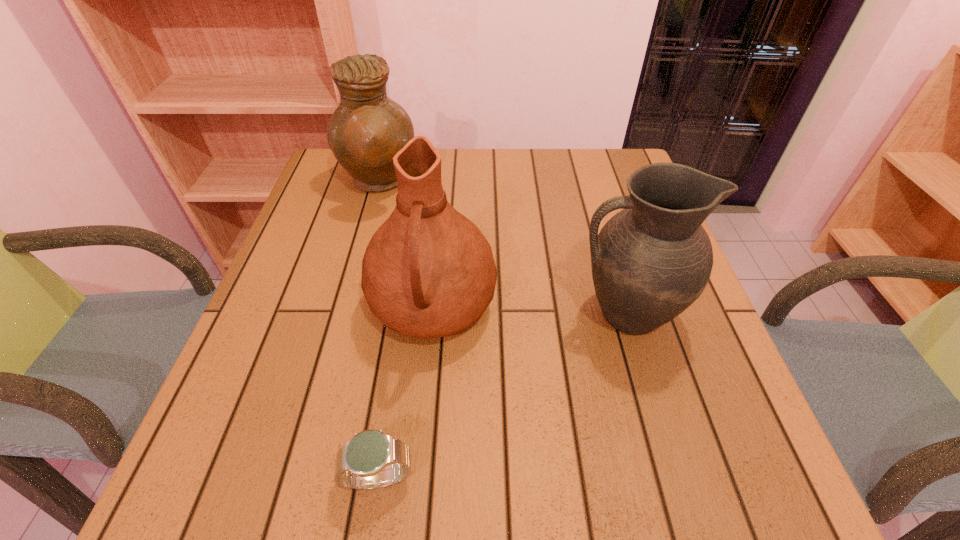
Image resolution: width=960 pixels, height=540 pixels. In order to click on empty location between the rightmost pitcher and the farthest pitcher in this screenshot , I will do `click(502, 248)`.

Locate an element on the screen. free space between the farthest pitcher and the watch is located at coordinates (378, 330).

This screenshot has height=540, width=960. I want to click on blank region between the farthest pitcher and the rightmost pitcher, so click(502, 248).

Where is `empty location between the rightmost pitcher and the watch`? This screenshot has width=960, height=540. empty location between the rightmost pitcher and the watch is located at coordinates (502, 396).

At what (x,y) coordinates should I click in order to perform the action: click on empty space between the farthest pitcher and the shortest object. Please return your answer as a coordinate pair (x, y). Image resolution: width=960 pixels, height=540 pixels. Looking at the image, I should click on (378, 330).

Select which object appears as the closest to the rightmost object. Please provide its 2D coordinates. Your answer should be formatted as a tuple, i.e. [(x, y)], where the tuple contains the x and y coordinates of a point satisfying the conditions above.

[(428, 271)]

Locate an element on the screen. The width and height of the screenshot is (960, 540). object that is the third closest one to the rightmost pitcher is located at coordinates (367, 129).

Identify which pitcher is located as the second nearest to the rightmost pitcher. Please provide its 2D coordinates. Your answer should be formatted as a tuple, i.e. [(x, y)], where the tuple contains the x and y coordinates of a point satisfying the conditions above.

[(367, 129)]

The image size is (960, 540). Find the location of `the closest pitcher to the shortest object`. the closest pitcher to the shortest object is located at coordinates (428, 271).

Where is `free spot that satisfies the following two spatial constraints: 1. at the spout of the shortest object; 2. on the left side of the farthest pitcher`? This screenshot has width=960, height=540. free spot that satisfies the following two spatial constraints: 1. at the spout of the shortest object; 2. on the left side of the farthest pitcher is located at coordinates (296, 478).